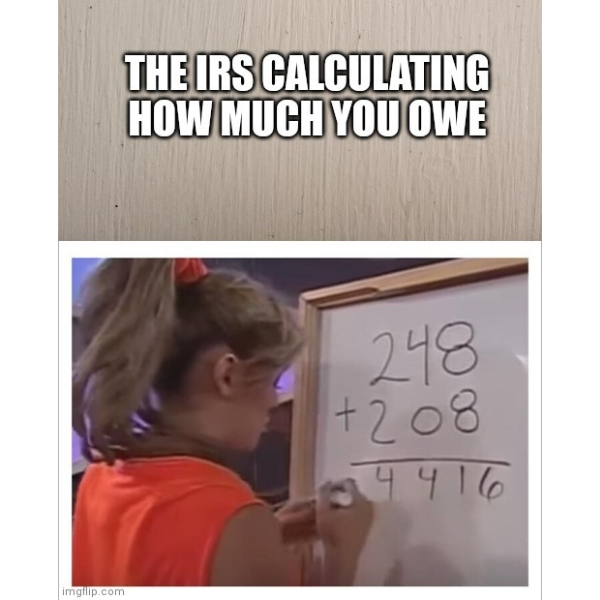
The width and height of the screenshot is (600, 600). I want to click on marker, so click(348, 499).